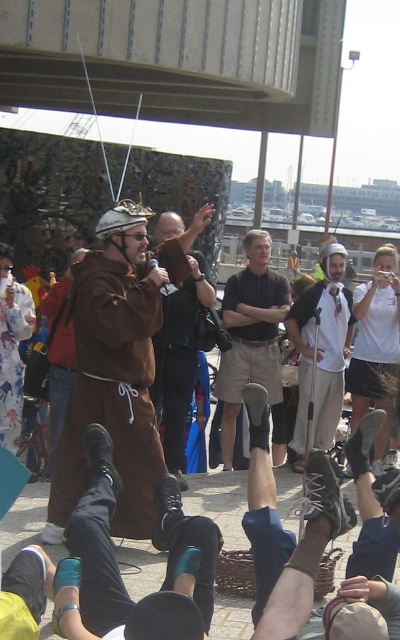
You are standing at the point with coordinates (x=118, y=365) in the image. What object are you directly touching?

The point at (x=118, y=365) is on the brown leather robe at center, so you are directly touching the brown leather robe at center.

You are standing at the entrance of the event area and want to locate the brown leather robe at center. Based on the coordinates provided in the description, can you determine its position relative to the center of the image?

The brown leather robe at center is located at coordinates approximately 57.3 percent along the horizontal axis and 29.5 percent along the vertical axis from the bottom left corner of the image. Since the center of the image would be at 50 percent on both axes, this places the robe slightly to the right and above the exact center point.